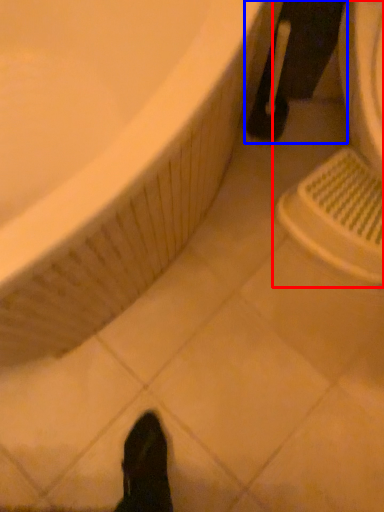
Question: Among these objects, which one is farthest to the camera, sink (highlighted by a red box) or leg (highlighted by a blue box)?

Choices:
 (A) sink
 (B) leg

Answer: (B)